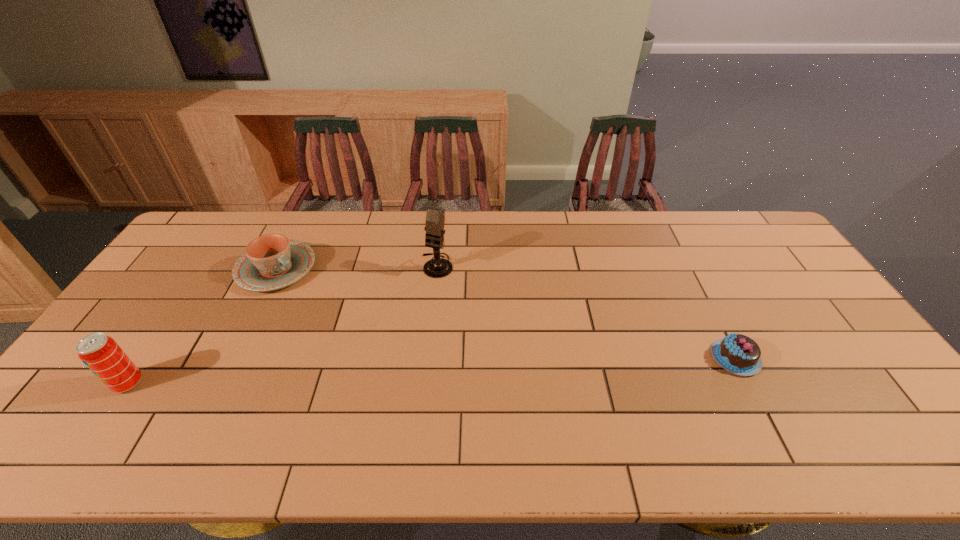
This screenshot has height=540, width=960. Find the location of `the second tallest object`. the second tallest object is located at coordinates (101, 354).

Where is `the leftmost object`? The width and height of the screenshot is (960, 540). the leftmost object is located at coordinates (101, 354).

You are a GUI agent. You are given a task and a screenshot of the screen. Output one action in this format:
    pyautogui.click(x=<x>, y=<y>)
    Task: Click on the rightmost object
    The height and width of the screenshot is (540, 960).
    Given the screenshot: What is the action you would take?
    pyautogui.click(x=739, y=354)

This screenshot has width=960, height=540. In order to click on the shortest object in this screenshot , I will do `click(739, 354)`.

The width and height of the screenshot is (960, 540). What are the coordinates of `microphone` in the screenshot? It's located at (438, 267).

At what (x,y) coordinates should I click in order to perform the action: click on the third object from left to right. Please return your answer as a coordinate pair (x, y). This screenshot has width=960, height=540. Looking at the image, I should click on (438, 267).

Locate an element on the screen. Image resolution: width=960 pixels, height=540 pixels. the second shortest object is located at coordinates (272, 261).

Where is `chinaware`? chinaware is located at coordinates (272, 261).

Identify the location of free space located on the back of the third shortest object. (179, 309).

The height and width of the screenshot is (540, 960). Identify the location of vacant region located on the left of the shortest object. (629, 357).